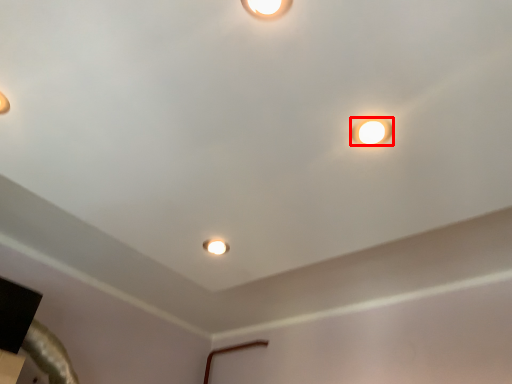
Question: From the image's perspective, where is lamp (annotated by the red box) located relative to stage light?

Choices:
 (A) above
 (B) below

Answer: (A)